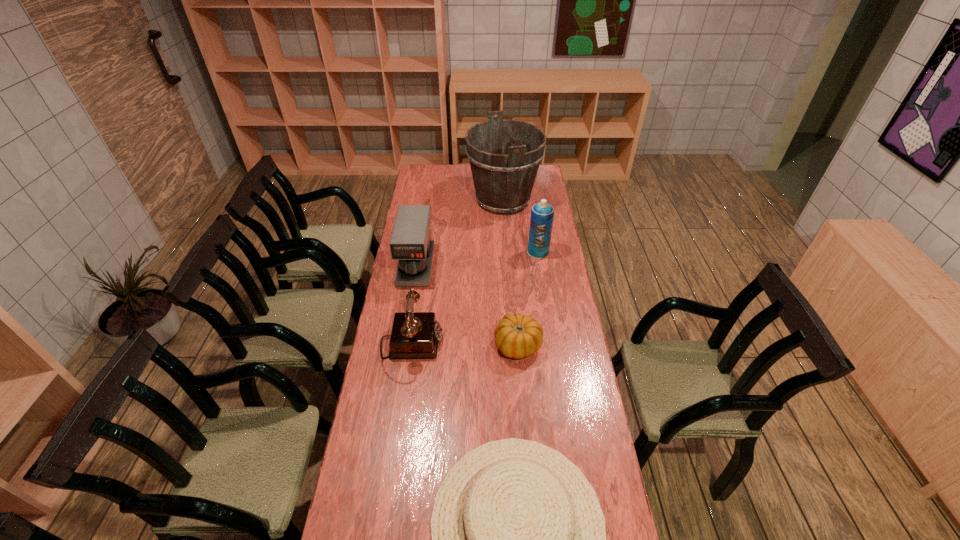
You are a GUI agent. You are given a task and a screenshot of the screen. Output one action in this format:
    pyautogui.click(x=<x>, y=<y>)
    Task: Click on the free space located 0.320m on the front of the second shortest object
    
    Given the screenshot: What is the action you would take?
    pyautogui.click(x=526, y=448)

Identify the location of object situated at the far edge. (504, 155).

Where is `coffee maker located at the left edge`? coffee maker located at the left edge is located at coordinates (410, 243).

Locate an element on the screen. telephone present at the left edge is located at coordinates (415, 335).

Find the location of `bucket that is at the right edge`. bucket that is at the right edge is located at coordinates (504, 155).

Where is `aerosol can located in the right edge section of the desktop`? The height and width of the screenshot is (540, 960). aerosol can located in the right edge section of the desktop is located at coordinates (542, 214).

Locate an element on the screen. The image size is (960, 540). gourd present at the right edge is located at coordinates (517, 336).

Locate an element on the screen. Image resolution: width=960 pixels, height=540 pixels. object at the far right corner is located at coordinates (504, 155).

Identify the location of free region at the left edge. This screenshot has height=540, width=960. (405, 442).

This screenshot has width=960, height=540. I want to click on vacant space at the right edge of the desktop, so click(563, 262).